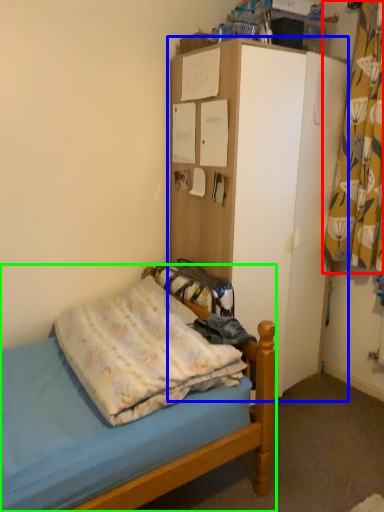
Question: Considering the real-world distances, which object is farthest from curtain (highlighted by a red box)? dresser (highlighted by a blue box) or bed (highlighted by a green box)?

Choices:
 (A) dresser
 (B) bed

Answer: (B)